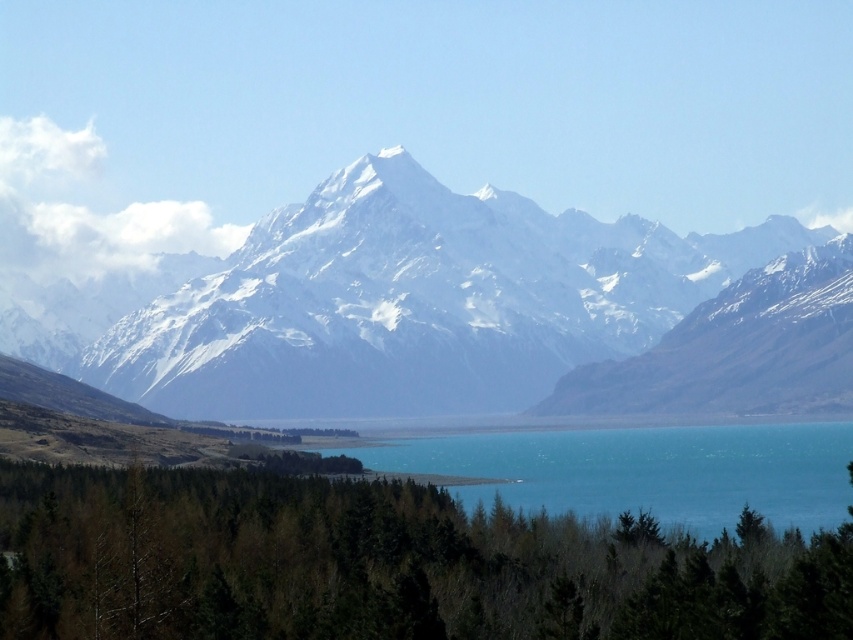
Does white snow-covered mountain range at upper center lie behind turquoise glassy water at center?

No, it is not.

Looking at this image, is white snow-covered mountain range at upper center thinner than turquoise glassy water at center?

No.

The width and height of the screenshot is (853, 640). What do you see at coordinates (386, 301) in the screenshot?
I see `white snow-covered mountain range at upper center` at bounding box center [386, 301].

In order to click on white snow-covered mountain range at upper center in this screenshot , I will do `click(386, 301)`.

Which is below, white snow-covered mountain range at upper center or green matte trees at lower center?

green matte trees at lower center is below.

Is point (396, 346) positioned in front of point (357, 509)?

That is True.

The width and height of the screenshot is (853, 640). Find the location of `white snow-covered mountain range at upper center`. white snow-covered mountain range at upper center is located at coordinates (386, 301).

Where is `green matte trees at lower center`? green matte trees at lower center is located at coordinates (380, 564).